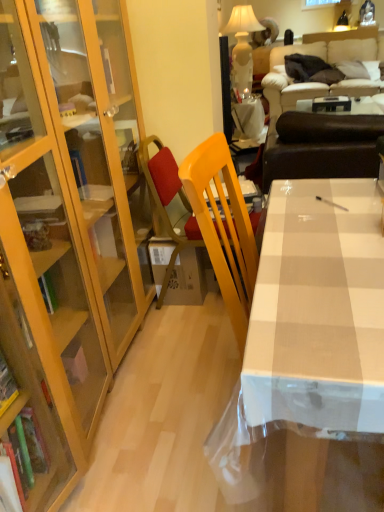
Question: Is white glossy table at upper center, the second table viewed from the right, located outside white glossy table at center?

Choices:
 (A) yes
 (B) no

Answer: (A)

Question: Could you tell me if white glossy table at upper center, the second table in the front-to-back sequence, is turned towards white glossy table at center?

Choices:
 (A) yes
 (B) no

Answer: (B)

Question: From a real-world perspective, is white glossy table at upper center, the second table viewed from the right, physically below white glossy table at center?

Choices:
 (A) yes
 (B) no

Answer: (A)

Question: Is white glossy table at center a part of white glossy table at upper center, the second table in the front-to-back sequence?

Choices:
 (A) no
 (B) yes

Answer: (A)

Question: Is white glossy table at upper center, positioned as the first table in left-to-right order, not close to white glossy table at center?

Choices:
 (A) yes
 (B) no

Answer: (A)

Question: Is white glossy table at upper center, the second table viewed from the right, next to white glossy table at center and touching it?

Choices:
 (A) yes
 (B) no

Answer: (B)

Question: Does white glossy table at center come in front of brown leather couch at upper right, which appears as the first studio couch when ordered from the bottom?

Choices:
 (A) no
 (B) yes

Answer: (B)

Question: Is white glossy table at center looking in the opposite direction of brown leather couch at upper right, placed as the second studio couch when sorted from back to front?

Choices:
 (A) no
 (B) yes

Answer: (A)

Question: From the image's perspective, would you say white glossy table at center is positioned over brown leather couch at upper right, acting as the first studio couch starting from the front?

Choices:
 (A) yes
 (B) no

Answer: (B)

Question: From a real-world perspective, does white glossy table at center stand above brown leather couch at upper right, placed as the second studio couch when sorted from back to front?

Choices:
 (A) no
 (B) yes

Answer: (A)

Question: Is white glossy table at center at the right side of brown leather couch at upper right, which appears as the first studio couch when ordered from the bottom?

Choices:
 (A) no
 (B) yes

Answer: (A)

Question: Is brown leather couch at upper right, acting as the first studio couch starting from the front, a part of white glossy table at center?

Choices:
 (A) no
 (B) yes

Answer: (A)

Question: Is white ceramic lamp at upper center to the right of white glossy table at center, the 1th table from the right, from the viewer's perspective?

Choices:
 (A) yes
 (B) no

Answer: (B)